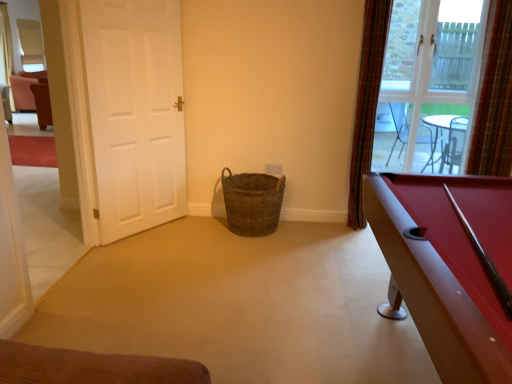
Question: Is the depth of plaid fabric curtain at right, which is counted as the 2th curtain, starting from the right, greater than that of plaid fabric curtain at upper right, the first curtain viewed from the right?

Choices:
 (A) yes
 (B) no

Answer: (A)

Question: Is plaid fabric curtain at right, which appears as the 1th curtain when viewed from the left, positioned with its back to plaid fabric curtain at upper right, which is the second curtain from left to right?

Choices:
 (A) yes
 (B) no

Answer: (B)

Question: Is plaid fabric curtain at right, which is counted as the 2th curtain, starting from the right, not inside plaid fabric curtain at upper right, the first curtain viewed from the right?

Choices:
 (A) yes
 (B) no

Answer: (A)

Question: Is plaid fabric curtain at right, which appears as the 1th curtain when viewed from the left, thinner than plaid fabric curtain at upper right, which is the second curtain from left to right?

Choices:
 (A) yes
 (B) no

Answer: (A)

Question: From a real-world perspective, is plaid fabric curtain at right, which is counted as the 2th curtain, starting from the right, on top of plaid fabric curtain at upper right, which is the second curtain from left to right?

Choices:
 (A) no
 (B) yes

Answer: (A)

Question: Is plaid fabric curtain at right, which appears as the 1th curtain when viewed from the left, bigger than plaid fabric curtain at upper right, which is the second curtain from left to right?

Choices:
 (A) yes
 (B) no

Answer: (B)

Question: Can you confirm if brown woven basket at center is taller than white matte door at left?

Choices:
 (A) no
 (B) yes

Answer: (A)

Question: Is brown woven basket at center looking in the opposite direction of white matte door at left?

Choices:
 (A) no
 (B) yes

Answer: (A)

Question: Is white matte door at left surrounded by brown woven basket at center?

Choices:
 (A) yes
 (B) no

Answer: (B)

Question: Does brown woven basket at center appear on the right side of white matte door at left?

Choices:
 (A) no
 (B) yes

Answer: (B)

Question: Is brown woven basket at center wider than white matte door at left?

Choices:
 (A) yes
 (B) no

Answer: (A)

Question: Considering the relative sizes of brown woven basket at center and white matte door at left in the image provided, is brown woven basket at center smaller than white matte door at left?

Choices:
 (A) no
 (B) yes

Answer: (B)

Question: Is brown woven basket at center positioned with its back to clear glass window at upper right?

Choices:
 (A) yes
 (B) no

Answer: (B)